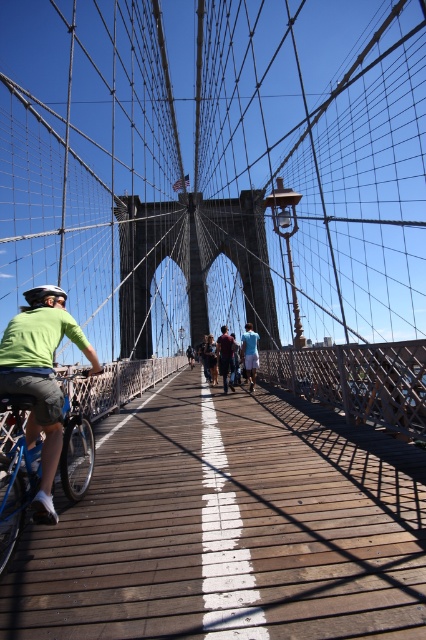
Who is lower down, blue metallic bicycle at left or maroon fabric shirt at center?

blue metallic bicycle at left is below.

Can you confirm if blue metallic bicycle at left is smaller than maroon fabric shirt at center?

No.

Who is more forward, (85, 438) or (233, 371)?

Point (85, 438) is more forward.

The height and width of the screenshot is (640, 426). I want to click on blue metallic bicycle at left, so click(x=16, y=477).

Is point (227, 371) farther from viewer compared to point (247, 337)?

Yes, it is.

What do you see at coordinates (226, 356) in the screenshot? The width and height of the screenshot is (426, 640). I see `maroon fabric shirt at center` at bounding box center [226, 356].

Locate an element on the screen. The image size is (426, 640). maroon fabric shirt at center is located at coordinates (226, 356).

Is blue metallic bicycle at left smaller than blue fabric shirt at center?

Correct, blue metallic bicycle at left occupies less space than blue fabric shirt at center.

Is blue metallic bicycle at left shorter than blue fabric shirt at center?

Correct, blue metallic bicycle at left is not as tall as blue fabric shirt at center.

Where is `blue metallic bicycle at left`? The width and height of the screenshot is (426, 640). blue metallic bicycle at left is located at coordinates (16, 477).